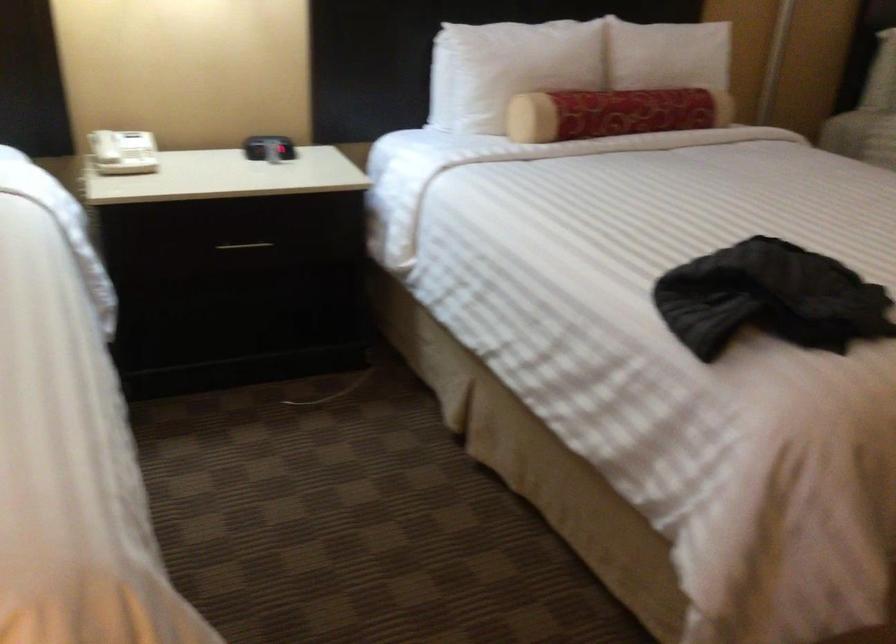
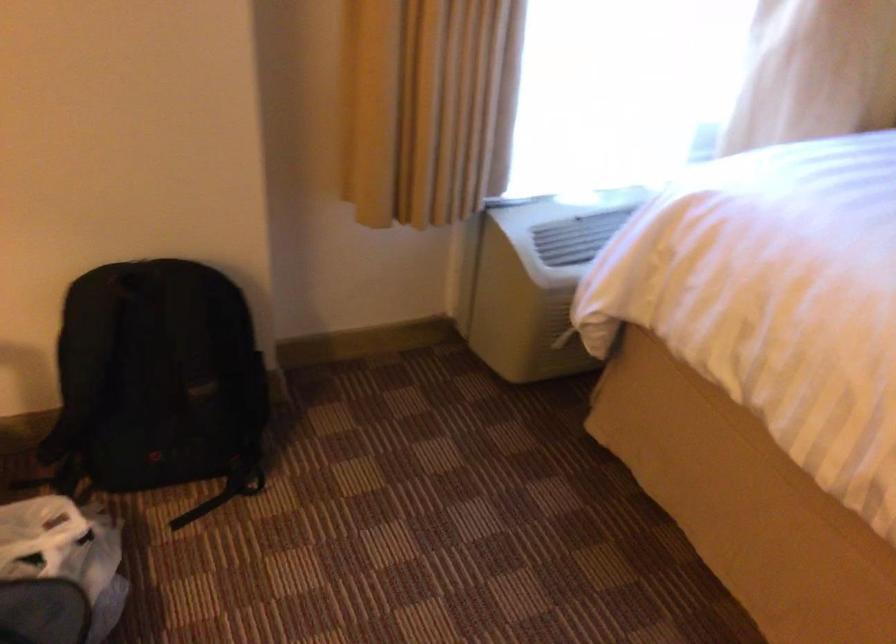
How did the camera likely rotate?

The rotation direction of the camera is left-down.